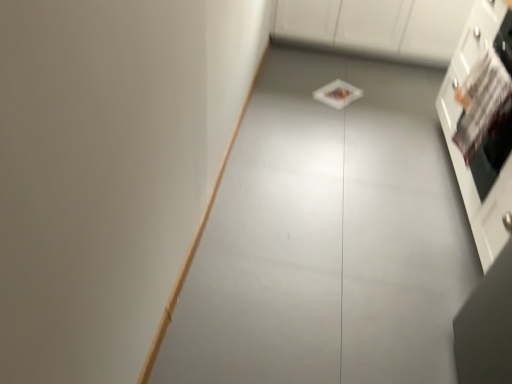
This screenshot has height=384, width=512. Find the location of `white glossy cabinet at right, marked as the 1th cabinetry in a front-to-back arrangement`. white glossy cabinet at right, marked as the 1th cabinetry in a front-to-back arrangement is located at coordinates point(482,123).

The image size is (512, 384). Describe the element at coordinates (482, 123) in the screenshot. I see `white glossy cabinet at right, the second cabinetry viewed from the back` at that location.

What is the approximate height of white glossy cabinet at upper center, the second cabinetry from the bottom?

The height of white glossy cabinet at upper center, the second cabinetry from the bottom, is 20.63 inches.

Image resolution: width=512 pixels, height=384 pixels. What do you see at coordinates (376, 26) in the screenshot?
I see `white glossy cabinet at upper center, which is the first cabinetry from top to bottom` at bounding box center [376, 26].

Measure the distance between white glossy cabinet at upper center, which is the first cabinetry from top to bottom, and camera.

They are 2.84 meters apart.

The image size is (512, 384). I want to click on white glossy cabinet at upper center, which is counted as the first cabinetry, starting from the back, so click(x=376, y=26).

This screenshot has height=384, width=512. Find the location of `white glossy cabinet at right, the second cabinetry from the top`. white glossy cabinet at right, the second cabinetry from the top is located at coordinates (482, 123).

Is white glossy cabinet at right, the second cabinetry viewed from the back, to the left or to the right of white glossy cabinet at upper center, which is the first cabinetry from top to bottom, in the image?

In the image, white glossy cabinet at right, the second cabinetry viewed from the back, appears on the right side of white glossy cabinet at upper center, which is the first cabinetry from top to bottom.

In the image, is white glossy cabinet at right, which is the 1th cabinetry from bottom to top, positioned in front of or behind white glossy cabinet at upper center, which is the first cabinetry from top to bottom?

Clearly, white glossy cabinet at right, which is the 1th cabinetry from bottom to top, is in front of white glossy cabinet at upper center, which is the first cabinetry from top to bottom.

Does point (441, 102) appear closer or farther from the camera than point (412, 38)?

Point (441, 102) appears to be closer to the viewer than point (412, 38).

From the image's perspective, does white glossy cabinet at right, which is the 1th cabinetry from bottom to top, appear lower than white glossy cabinet at upper center, which is counted as the first cabinetry, starting from the back?

Yes, from the image's perspective, white glossy cabinet at right, which is the 1th cabinetry from bottom to top, is below white glossy cabinet at upper center, which is counted as the first cabinetry, starting from the back.

From a real-world perspective, is white glossy cabinet at right, the second cabinetry viewed from the back, physically located above or below white glossy cabinet at upper center, the second cabinetry from the bottom?

In terms of real-world spatial position, white glossy cabinet at right, the second cabinetry viewed from the back, is above white glossy cabinet at upper center, the second cabinetry from the bottom.

Consider the image. Between white glossy cabinet at right, the second cabinetry from the top, and white glossy cabinet at upper center, which is counted as the first cabinetry, starting from the back, which one has larger width?

white glossy cabinet at upper center, which is counted as the first cabinetry, starting from the back, is wider.

Considering the relative sizes of white glossy cabinet at right, the second cabinetry viewed from the back, and white glossy cabinet at upper center, arranged as the second cabinetry when viewed from the front, in the image provided, is white glossy cabinet at right, the second cabinetry viewed from the back, taller than white glossy cabinet at upper center, arranged as the second cabinetry when viewed from the front,?

Correct, white glossy cabinet at right, the second cabinetry viewed from the back, is much taller as white glossy cabinet at upper center, arranged as the second cabinetry when viewed from the front.

Does white glossy cabinet at right, the second cabinetry viewed from the back, have a larger size compared to white glossy cabinet at upper center, arranged as the second cabinetry when viewed from the front?

Yes, white glossy cabinet at right, the second cabinetry viewed from the back, is bigger than white glossy cabinet at upper center, arranged as the second cabinetry when viewed from the front.

Is white glossy cabinet at upper center, arranged as the second cabinetry when viewed from the front, surrounded by white glossy cabinet at right, marked as the 1th cabinetry in a front-to-back arrangement?

That's incorrect, white glossy cabinet at upper center, arranged as the second cabinetry when viewed from the front, is not inside white glossy cabinet at right, marked as the 1th cabinetry in a front-to-back arrangement.

Is white glossy cabinet at right, marked as the 1th cabinetry in a front-to-back arrangement, placed right next to white glossy cabinet at upper center, which is counted as the first cabinetry, starting from the back?

They are not placed beside each other.

Is white glossy cabinet at right, the second cabinetry from the top, aimed at white glossy cabinet at upper center, the second cabinetry from the bottom?

No, white glossy cabinet at right, the second cabinetry from the top, does not turn towards white glossy cabinet at upper center, the second cabinetry from the bottom.

Could you measure the distance between white glossy cabinet at right, which is the 1th cabinetry from bottom to top, and white glossy cabinet at upper center, the second cabinetry from the bottom?

1.15 meters.

In the image, there is a white glossy cabinet at upper center, arranged as the second cabinetry when viewed from the front. Where is `cabinetry below it (from the image's perspective)`? Image resolution: width=512 pixels, height=384 pixels. cabinetry below it (from the image's perspective) is located at coordinates (482, 123).

Is white glossy cabinet at upper center, arranged as the second cabinetry when viewed from the front, at the right side of white glossy cabinet at right, marked as the 1th cabinetry in a front-to-back arrangement?

Incorrect, white glossy cabinet at upper center, arranged as the second cabinetry when viewed from the front, is not on the right side of white glossy cabinet at right, marked as the 1th cabinetry in a front-to-back arrangement.

In the image, is white glossy cabinet at upper center, arranged as the second cabinetry when viewed from the front, positioned in front of or behind white glossy cabinet at right, the second cabinetry viewed from the back?

Clearly, white glossy cabinet at upper center, arranged as the second cabinetry when viewed from the front, is behind white glossy cabinet at right, the second cabinetry viewed from the back.

Is point (451, 53) closer to camera compared to point (438, 105)?

No, (451, 53) is further to viewer.

From the image's perspective, is white glossy cabinet at upper center, the second cabinetry from the bottom, below white glossy cabinet at right, which is the 1th cabinetry from bottom to top?

No.

From a real-world perspective, is white glossy cabinet at upper center, the second cabinetry from the bottom, physically located above or below white glossy cabinet at right, marked as the 1th cabinetry in a front-to-back arrangement?

In terms of real-world spatial position, white glossy cabinet at upper center, the second cabinetry from the bottom, is below white glossy cabinet at right, marked as the 1th cabinetry in a front-to-back arrangement.

Is white glossy cabinet at upper center, the second cabinetry from the bottom, thinner than white glossy cabinet at right, marked as the 1th cabinetry in a front-to-back arrangement?

No.

Is white glossy cabinet at upper center, arranged as the second cabinetry when viewed from the front, taller or shorter than white glossy cabinet at right, which is the 1th cabinetry from bottom to top?

Considering their sizes, white glossy cabinet at upper center, arranged as the second cabinetry when viewed from the front, has less height than white glossy cabinet at right, which is the 1th cabinetry from bottom to top.

Does white glossy cabinet at upper center, arranged as the second cabinetry when viewed from the front, have a smaller size compared to white glossy cabinet at right, the second cabinetry viewed from the back?

Correct, white glossy cabinet at upper center, arranged as the second cabinetry when viewed from the front, occupies less space than white glossy cabinet at right, the second cabinetry viewed from the back.

Do you think white glossy cabinet at upper center, which is the first cabinetry from top to bottom, is within white glossy cabinet at right, the second cabinetry viewed from the back, or outside of it?

white glossy cabinet at upper center, which is the first cabinetry from top to bottom, lies outside white glossy cabinet at right, the second cabinetry viewed from the back.

Is white glossy cabinet at upper center, which is the first cabinetry from top to bottom, far from white glossy cabinet at right, the second cabinetry viewed from the back?

white glossy cabinet at upper center, which is the first cabinetry from top to bottom, is far away from white glossy cabinet at right, the second cabinetry viewed from the back.

Is white glossy cabinet at upper center, arranged as the second cabinetry when viewed from the front, turned away from white glossy cabinet at right, marked as the 1th cabinetry in a front-to-back arrangement?

No, white glossy cabinet at upper center, arranged as the second cabinetry when viewed from the front, is not facing the opposite direction of white glossy cabinet at right, marked as the 1th cabinetry in a front-to-back arrangement.

Can you tell me how much white glossy cabinet at upper center, arranged as the second cabinetry when viewed from the front, and white glossy cabinet at right, marked as the 1th cabinetry in a front-to-back arrangement, differ in facing direction?

The angular difference between white glossy cabinet at upper center, arranged as the second cabinetry when viewed from the front, and white glossy cabinet at right, marked as the 1th cabinetry in a front-to-back arrangement, is 90.3 degrees.

Identify the location of cabinetry behind the white glossy cabinet at right, the second cabinetry viewed from the back. Image resolution: width=512 pixels, height=384 pixels. (376, 26).

In the image, there is a white glossy cabinet at upper center, which is counted as the first cabinetry, starting from the back. Where is `cabinetry below it (from the image's perspective)`? cabinetry below it (from the image's perspective) is located at coordinates (482, 123).

You are a GUI agent. You are given a task and a screenshot of the screen. Output one action in this format:
    pyautogui.click(x=<x>, y=<y>)
    Task: Click on the cabinetry that appears behind the white glossy cabinet at right, which is the 1th cabinetry from bottom to top
    
    Given the screenshot: What is the action you would take?
    pyautogui.click(x=376, y=26)